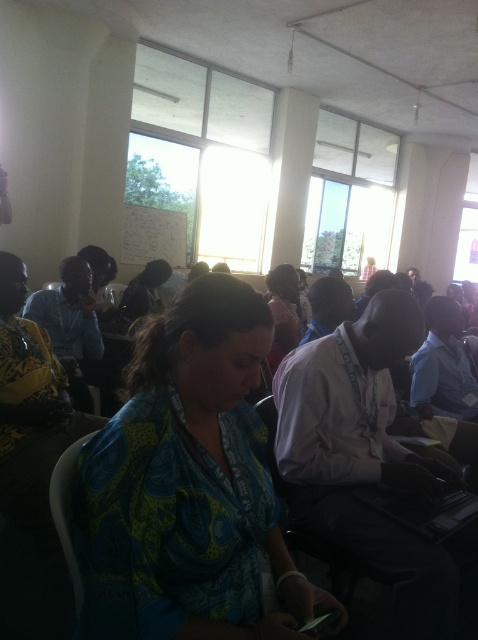
Question: Does whiteboard at upper center come behind matte pink shirt at center?

Choices:
 (A) no
 (B) yes

Answer: (B)

Question: Is whiteboard at upper center above matte pink shirt at center?

Choices:
 (A) yes
 (B) no

Answer: (A)

Question: Which point is closer to the camera?

Choices:
 (A) printed fabric shirt at center
 (B) whiteboard at upper center

Answer: (A)

Question: Which point is farther to the camera?

Choices:
 (A) whiteboard at upper center
 (B) matte pink shirt at center

Answer: (A)

Question: In this image, where is printed fabric shirt at center located relative to matte pink shirt at center?

Choices:
 (A) above
 (B) below

Answer: (B)

Question: Which of the following is the farthest from the observer?

Choices:
 (A) (275, 358)
 (B) (147, 406)

Answer: (A)